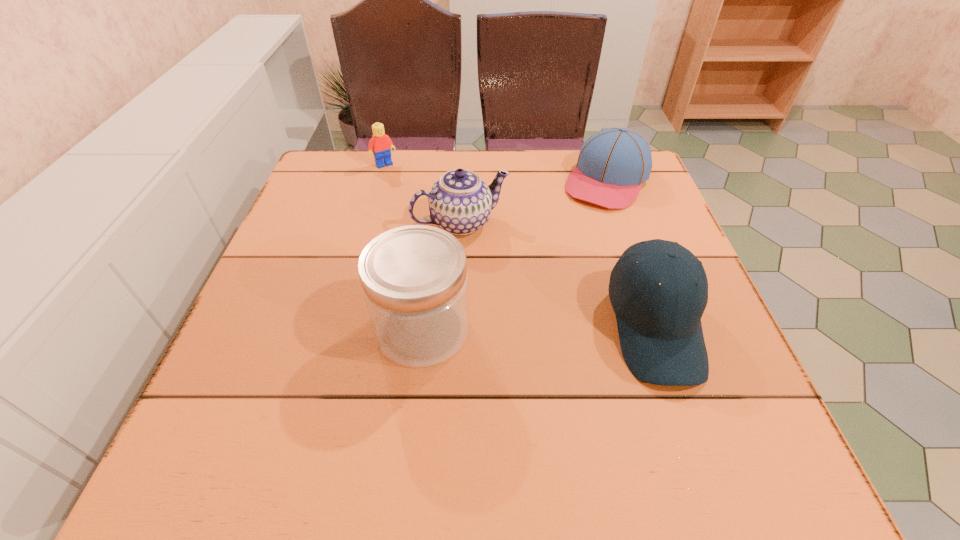
Locate an element on the screen. This screenshot has width=960, height=540. jar is located at coordinates (414, 278).

I want to click on the nearer baseball cap, so click(x=659, y=326).

The height and width of the screenshot is (540, 960). What are the coordinates of `the leftmost object` in the screenshot? It's located at (381, 143).

Find the location of a particular element. chinaware is located at coordinates (460, 202).

Find the location of `the farther baseball cap`. the farther baseball cap is located at coordinates (612, 165).

At what (x,y) coordinates should I click in order to perform the action: click on free space located 0.090m on the back of the tallest object. Please return your answer as a coordinate pair (x, y). This screenshot has width=960, height=540. Looking at the image, I should click on (430, 264).

This screenshot has width=960, height=540. What are the coordinates of `free space located on the face of the Lego` in the screenshot? It's located at (436, 231).

The image size is (960, 540). I want to click on vacant area situated 0.330m on the face of the Lego, so 442,239.

The width and height of the screenshot is (960, 540). What are the coordinates of `vacant position located on the face of the Lego` in the screenshot? It's located at (417, 205).

Identify the location of blank area located 0.210m at the spout of the chinaware. This screenshot has width=960, height=540. (521, 308).